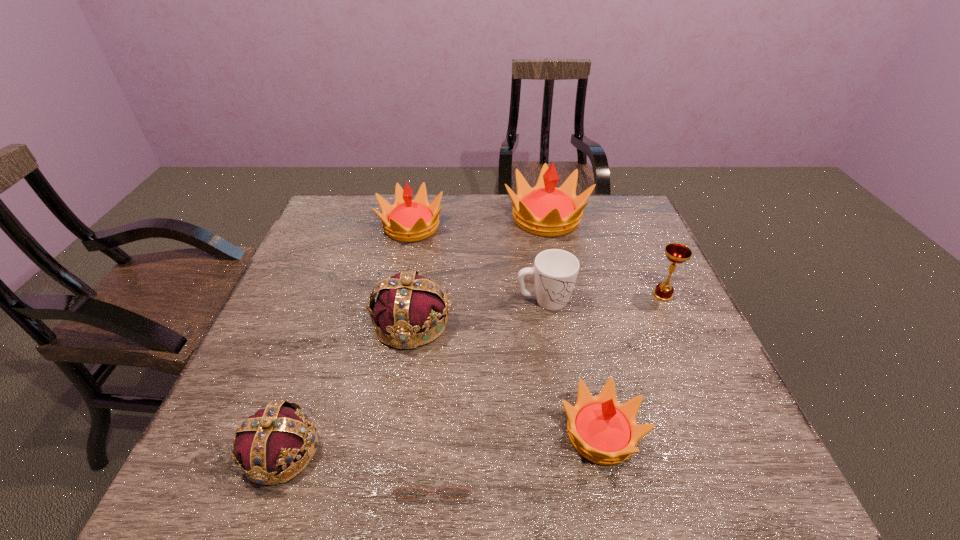
Where is `free space that satisfies the following two spatial constraints: 1. on the front side of the smallest yellow crown; 2. on the right side of the leftmost yellow crown`? The width and height of the screenshot is (960, 540). free space that satisfies the following two spatial constraints: 1. on the front side of the smallest yellow crown; 2. on the right side of the leftmost yellow crown is located at coordinates (369, 434).

The height and width of the screenshot is (540, 960). I want to click on free spot that satisfies the following two spatial constraints: 1. on the back side of the farther purple crown; 2. on the left side of the chalice, so click(416, 295).

At what (x,y) coordinates should I click in order to perform the action: click on vacant space that satisfies the following two spatial constraints: 1. on the side of the mug with the handle; 2. on the face of the sunglasses. Please return your answer as a coordinate pair (x, y). Image resolution: width=960 pixels, height=540 pixels. Looking at the image, I should click on (571, 470).

At what (x,y) coordinates should I click in order to perform the action: click on free space that satisfies the following two spatial constraints: 1. on the front side of the chalice; 2. on the side of the mug with the handle. Please return your answer as a coordinate pair (x, y). Image resolution: width=960 pixels, height=540 pixels. Looking at the image, I should click on (665, 301).

This screenshot has width=960, height=540. What are the coordinates of `vacant region that satisfies the following two spatial constraints: 1. on the front side of the third farthest crown; 2. on the left side of the second biggest yellow crown` in the screenshot? It's located at (392, 322).

You are a GUI agent. You are given a task and a screenshot of the screen. Output one action in this format:
    pyautogui.click(x=<x>, y=<y>)
    Task: Click on the vacant space that satisfies the following two spatial constraints: 1. on the side of the mug with the handle; 2. on the left side of the nearest yellow crown
    The height and width of the screenshot is (540, 960).
    Given the screenshot: What is the action you would take?
    pyautogui.click(x=565, y=434)